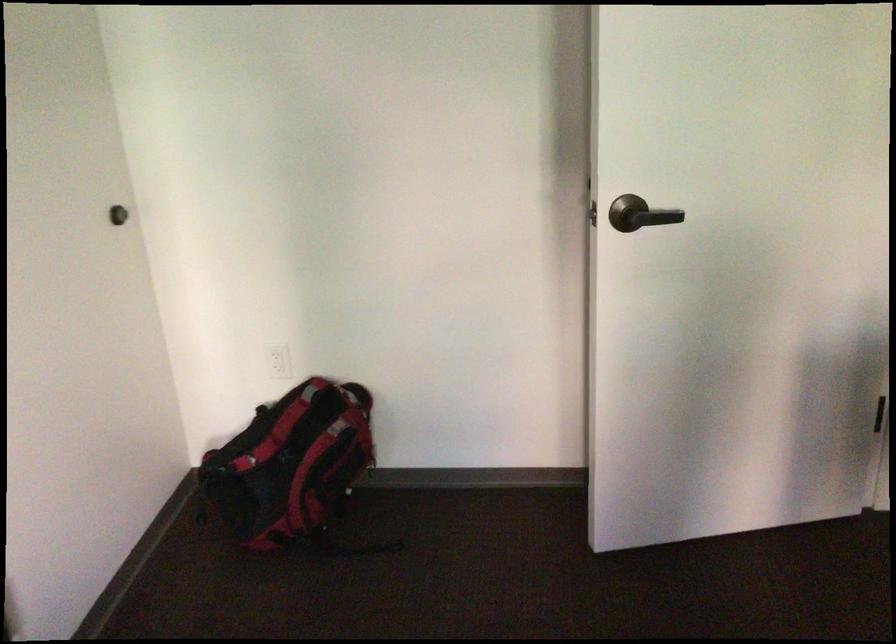
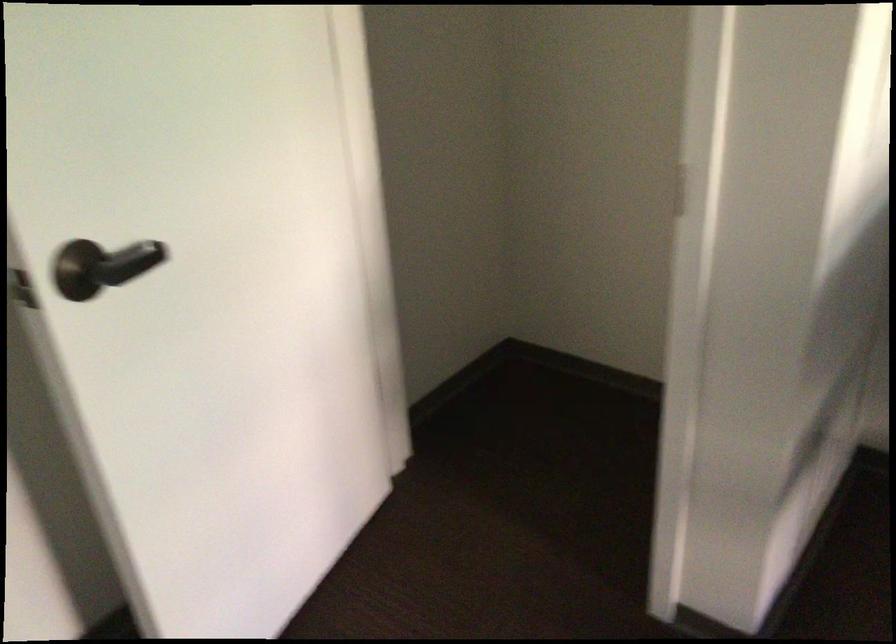
Question: The camera is either moving clockwise (left) or counter-clockwise (right) around the object. The first image is from the beginning of the video and the second image is from the end. Is the camera moving left or right when shooting the video?

Choices:
 (A) Left
 (B) Right

Answer: (A)